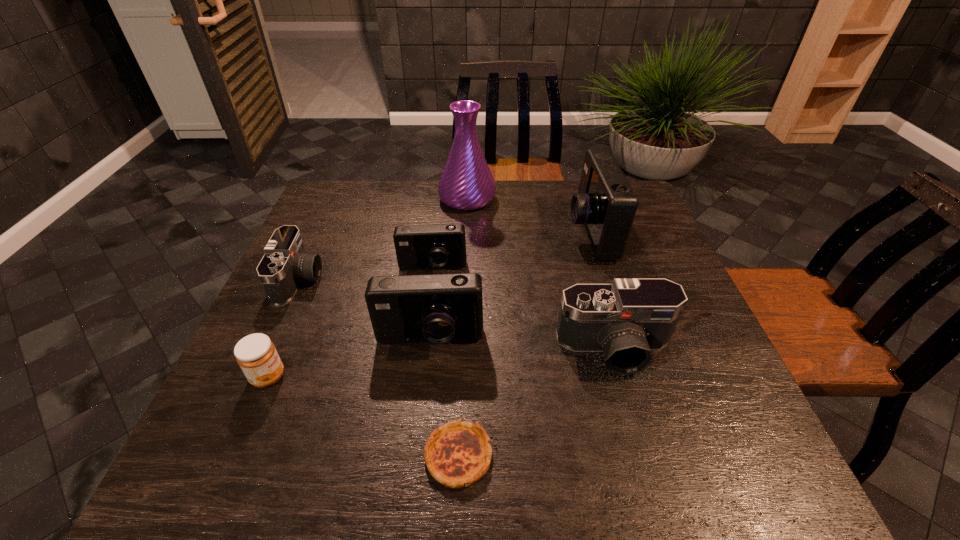
The height and width of the screenshot is (540, 960). Find the location of `free space between the second biggest blue camera and the left black camera`. free space between the second biggest blue camera and the left black camera is located at coordinates (365, 310).

The width and height of the screenshot is (960, 540). I want to click on vacant area that lies between the quiche and the farther black camera, so click(x=379, y=368).

Image resolution: width=960 pixels, height=540 pixels. Find the location of `object that is the fourth nearest to the vase`. object that is the fourth nearest to the vase is located at coordinates (437, 308).

Where is `object that is the seventh nearest to the orange jam`? object that is the seventh nearest to the orange jam is located at coordinates (605, 204).

Select which camera appears as the fourth closest to the leftmost camera. Please provide its 2D coordinates. Your answer should be formatted as a tuple, i.e. [(x, y)], where the tuple contains the x and y coordinates of a point satisfying the conditions above.

[(605, 204)]

This screenshot has width=960, height=540. What are the coordinates of `camera that can be found as the fourth closest to the second biggest blue camera` in the screenshot? It's located at (605, 204).

Point out which blue camera is positioned as the second nearest to the left black camera. Please provide its 2D coordinates. Your answer should be formatted as a tuple, i.e. [(x, y)], where the tuple contains the x and y coordinates of a point satisfying the conditions above.

[(438, 246)]

Locate an element on the screen. blue camera that is the closest to the jam is located at coordinates (437, 308).

The height and width of the screenshot is (540, 960). Identify the location of vacant space that satisfies the following two spatial constraints: 1. on the front-facing side of the tallest camera; 2. on the front-facing side of the smallest blue camera. (600, 268).

Where is `vacant space that satisfies the following two spatial constraints: 1. on the front-facing side of the farther black camera; 2. on the back side of the nearest object`? vacant space that satisfies the following two spatial constraints: 1. on the front-facing side of the farther black camera; 2. on the back side of the nearest object is located at coordinates (221, 456).